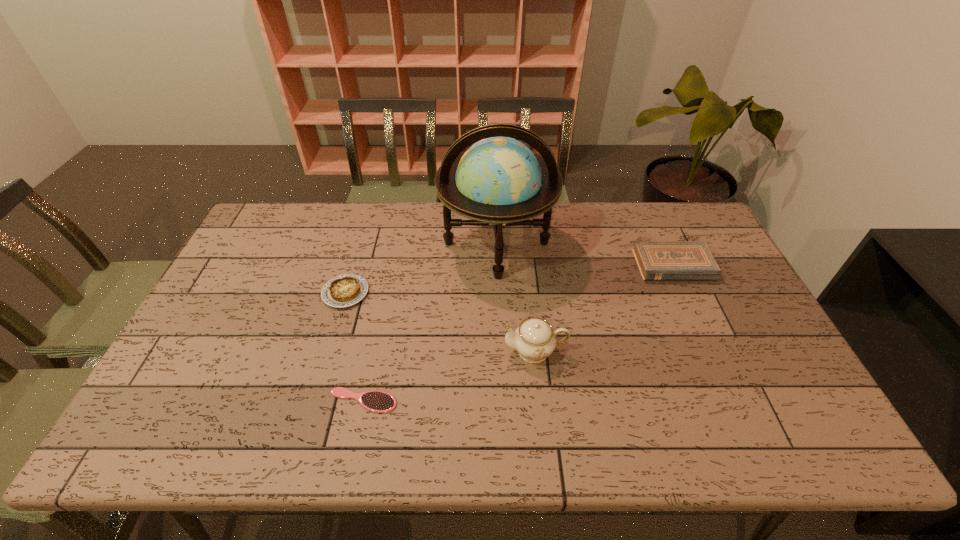
Locate an element on the screen. This screenshot has height=540, width=960. vacant space that's between the Bible and the fourth tallest object is located at coordinates (510, 279).

Find the location of `the closest object relative to the chinaware`. the closest object relative to the chinaware is located at coordinates (497, 182).

Where is `the second closest object to the hairbrush`? This screenshot has height=540, width=960. the second closest object to the hairbrush is located at coordinates (534, 339).

The height and width of the screenshot is (540, 960). What are the coordinates of `vacant region that satisfies the following two spatial constraints: 1. on the front side of the quiche; 2. on the left side of the shortest object` in the screenshot? It's located at (314, 401).

Image resolution: width=960 pixels, height=540 pixels. I want to click on vacant space that satisfies the following two spatial constraints: 1. on the spine side of the rightmost object; 2. at the spout of the fourth shortest object, so click(x=712, y=350).

This screenshot has width=960, height=540. I want to click on free space that satisfies the following two spatial constraints: 1. on the spine side of the third tallest object; 2. at the spout of the fourth shortest object, so click(712, 350).